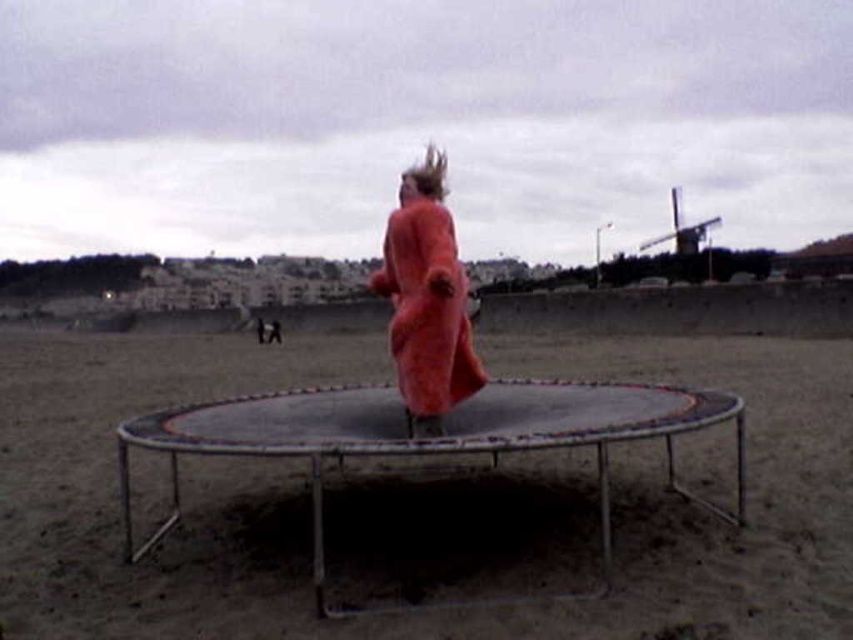
Is brown sandy dirt at center above fuzzy coral coat at center?

No, brown sandy dirt at center is not above fuzzy coral coat at center.

How distant is brown sandy dirt at center from fuzzy coral coat at center?

brown sandy dirt at center is 6.69 meters from fuzzy coral coat at center.

Measure the distance between brown sandy dirt at center and camera.

A distance of 11.00 feet exists between brown sandy dirt at center and camera.

I want to click on brown sandy dirt at center, so click(x=308, y=502).